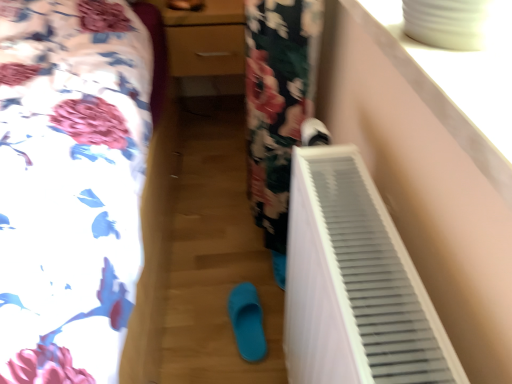
Question: Is white plastic radiator at lower right inside the boundaries of blue rubber slipper at center, placed as the 1th footwear when sorted from bottom to top, or outside?

Choices:
 (A) inside
 (B) outside

Answer: (B)

Question: Considering their positions, is white plastic radiator at lower right located in front of or behind blue rubber slipper at center, the 2th footwear in the front-to-back sequence?

Choices:
 (A) behind
 (B) front

Answer: (B)

Question: Based on their relative distances, which object is farther from the blue rubber slipper at center, the 2th footwear in the front-to-back sequence?

Choices:
 (A) white matte shoe at upper right, acting as the 2th footwear starting from the left
 (B) white plastic radiator at lower right
 (C) matte wood dresser at center
 (D) white plastic radiator at right

Answer: (C)

Question: Based on their relative distances, which object is nearer to the white matte shoe at upper right, the second footwear in the back-to-front sequence?

Choices:
 (A) white plastic radiator at lower right
 (B) blue rubber slipper at center, placed as the 1th footwear when sorted from bottom to top
 (C) matte wood dresser at center
 (D) white plastic radiator at right

Answer: (D)